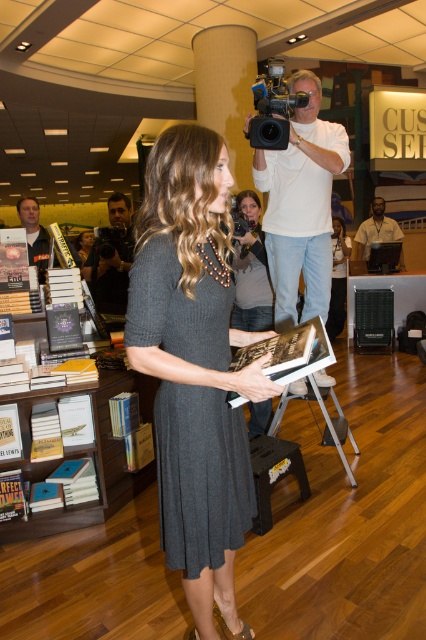
You are a photographer at the signing event and need to capture a clear shot of the black matte dress at center without the dark gray wood bookshelf at center blocking the view. Can you position yourself in a way that allows this?

The dark gray wood bookshelf at center is closer to the viewer than the black matte dress at center, so you would need to move around or behind the bookshelf to get an unobstructed view of the dress.

Looking at this image, you are a customer in the bookstore and want to find the dark gray wood bookshelf at center. The store is quite crowded with people. Can you estimate how far the point marked at coordinate (83, 456) is from the dark gray wood bookshelf at center?

The point marked at coordinate (83, 456) corresponds exactly to the dark gray wood bookshelf at center, so the distance is zero.